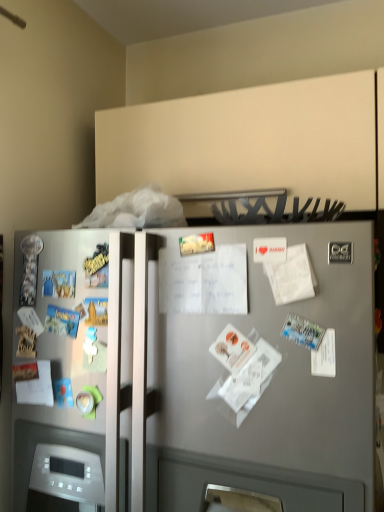
Question: From the image's perspective, is white matte paper at center-right, the first paper when ordered from right to left, located above or below white paper at left, arranged as the 3th paper when viewed from the top?

Choices:
 (A) below
 (B) above

Answer: (B)

Question: Is white matte paper at center-right, marked as the third paper in a bottom-to-top arrangement, inside the boundaries of white paper at left, marked as the first paper in a left-to-right arrangement, or outside?

Choices:
 (A) outside
 (B) inside

Answer: (A)

Question: Which object is the closest to the satin silver refrigerator at center?

Choices:
 (A) white paper at center, which ranks as the 2th paper in left-to-right order
 (B) white paper at left, which is counted as the 1th paper, starting from the bottom
 (C) white matte paper at center-right, the third paper from the left

Answer: (A)

Question: Based on their relative distances, which object is farther from the satin silver refrigerator at center?

Choices:
 (A) white matte paper at center-right, the third paper from the left
 (B) white paper at center, which ranks as the second paper in top-to-bottom order
 (C) white paper at left, arranged as the 3th paper when viewed from the front

Answer: (C)